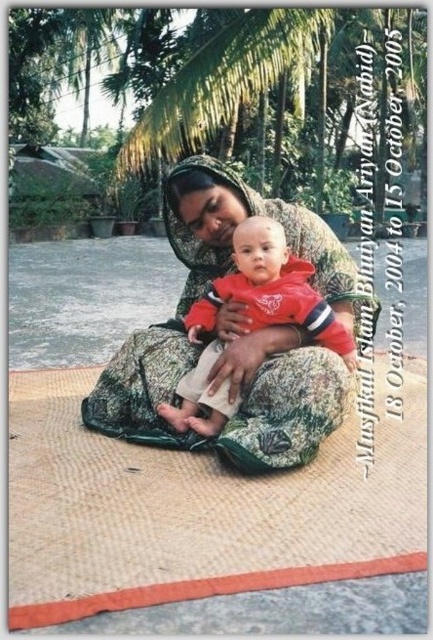
Question: Is burlap mat at center to the right of camouflage fabric at center from the viewer's perspective?

Choices:
 (A) no
 (B) yes

Answer: (A)

Question: Does burlap mat at center lie in front of red fleece jacket at center?

Choices:
 (A) no
 (B) yes

Answer: (B)

Question: Which is nearer to the burlap mat at center?

Choices:
 (A) camouflage fabric at center
 (B) red fleece jacket at center

Answer: (A)

Question: Which point is farther to the camera?

Choices:
 (A) (391, 563)
 (B) (203, 349)

Answer: (B)

Question: Is burlap mat at center positioned before red fleece jacket at center?

Choices:
 (A) yes
 (B) no

Answer: (A)

Question: Which object is the closest to the red fleece jacket at center?

Choices:
 (A) burlap mat at center
 (B) camouflage fabric at center

Answer: (B)